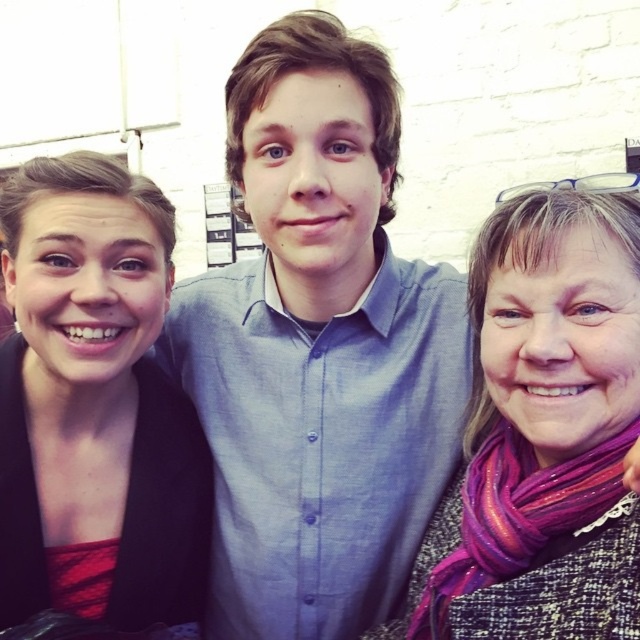
You are a photographer setting up a shoot. You have two subjects wearing the blue cotton shirt at center and the matte black jacket at left. The camera is positioned at eye level. Which subject should you adjust to ensure both are fully visible in the frame?

The blue cotton shirt at center is located above the matte black jacket at left, so you should lower the blue cotton shirt at center or raise the matte black jacket at left to ensure both are fully visible in the frame.

Based on the photo, you are standing in front of a group photo of three people. You notice the matte black jacket at left and the purple glitter scarf at center. Which object is closer to you?

The matte black jacket at left is closer to you because it is further to the viewer than the purple glitter scarf at center.

You are a photographer setting up for a group photo. You notice the matte black jacket at left and the purple glitter scarf at center. Which object is positioned higher in the image?

The matte black jacket at left is located above the purple glitter scarf at center, so it is positioned higher in the image.